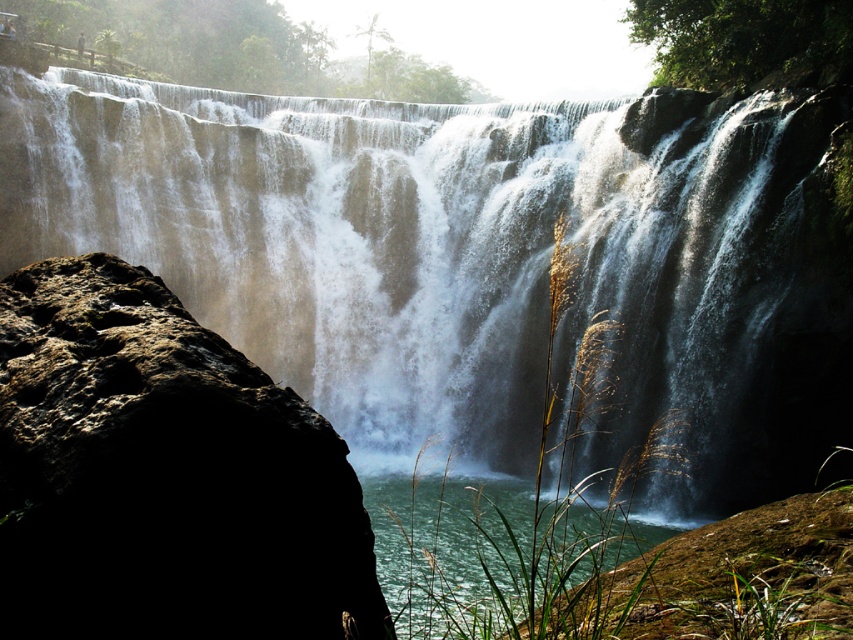
Question: Which object appears farthest from the camera in this image?

Choices:
 (A) clear water at lower center
 (B) rough brown rock at left
 (C) white frothy water at center

Answer: (C)

Question: Is white frothy water at center closer to the viewer compared to clear water at lower center?

Choices:
 (A) no
 (B) yes

Answer: (A)

Question: Which of these objects is positioned farthest from the white frothy water at center?

Choices:
 (A) rough brown rock at left
 (B) clear water at lower center

Answer: (A)

Question: Which is nearer to the white frothy water at center?

Choices:
 (A) clear water at lower center
 (B) rough brown rock at left

Answer: (A)

Question: Observing the image, what is the correct spatial positioning of rough brown rock at left in reference to clear water at lower center?

Choices:
 (A) below
 (B) above

Answer: (B)

Question: Is white frothy water at center bigger than rough brown rock at left?

Choices:
 (A) no
 (B) yes

Answer: (B)